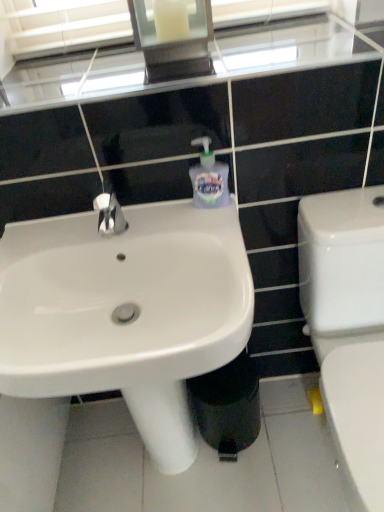
Where is `vacant space underneath white glossy sink at center (from a real-world perspective)`? The width and height of the screenshot is (384, 512). vacant space underneath white glossy sink at center (from a real-world perspective) is located at coordinates pyautogui.click(x=149, y=466).